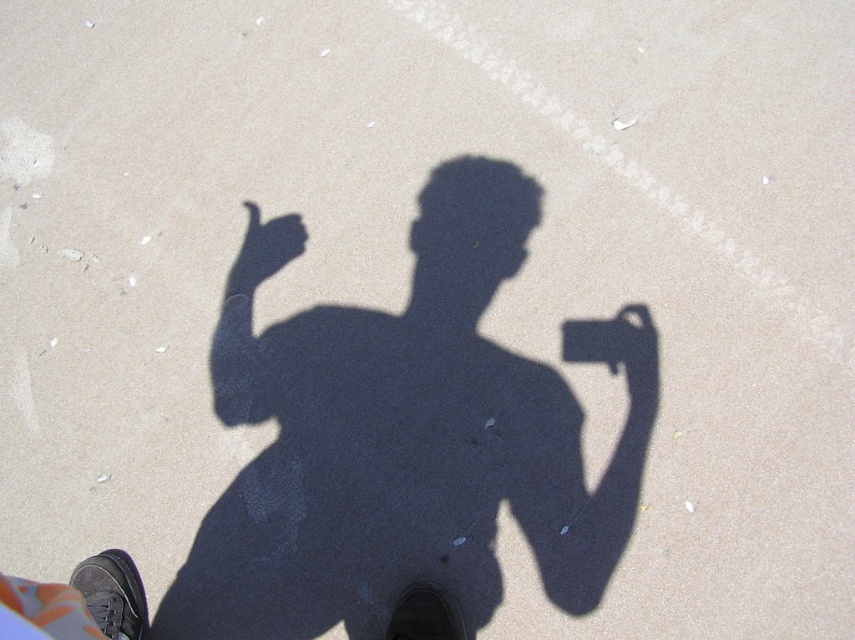
You are a photographer trying to capture the perfect shot of the matte black hand at center and the metallic silver phone at center. Based on their sizes in the image, which object should you move closer to the camera to make them appear the same size in the photo?

Since the matte black hand at center is larger than the metallic silver phone at center, you should move the metallic silver phone at center closer to the camera to make them appear the same size in the photo.

You are a photographer trying to capture a perfect shot of the matte black hand at center. You need to position yourself exactly 2 meters away from it. Based on the scene description, can you confirm if your current position meets this requirement?

The matte black hand at center is 1.92 meters away from the camera, so your current position is slightly closer than the required 2 meters. You need to move back approximately 0.08 meters to achieve the desired distance.

You are a photographer trying to position your matte black hand at center for a perfect shot. The camera requires the hand to be placed at coordinates between 0.3 and 0.35 on the x and y axes. Is your hand currently positioned correctly?

The matte black hand at center is at point [264,250]. The x coordinate 0.392 is outside the required range of 0.3 to 0.35, so the hand is not positioned correctly.